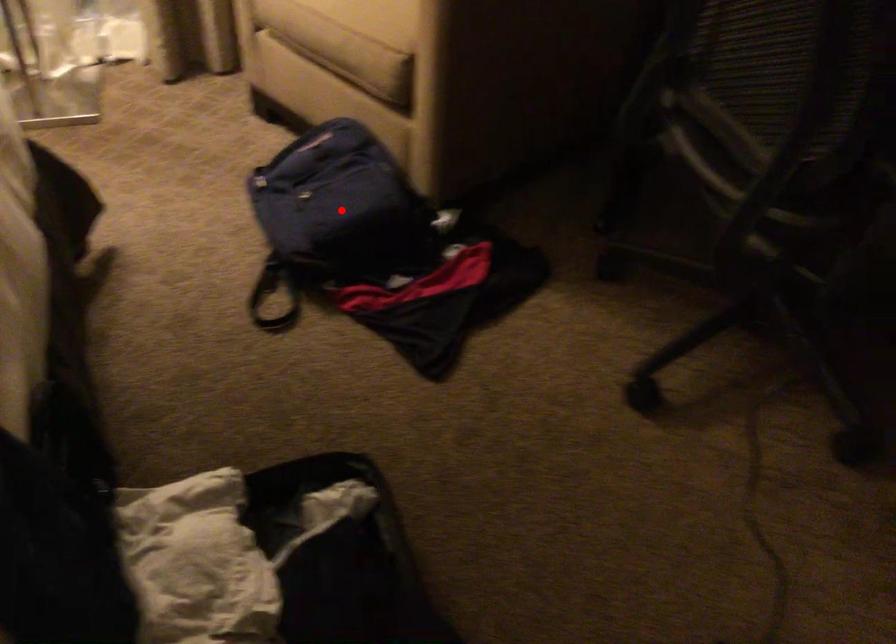
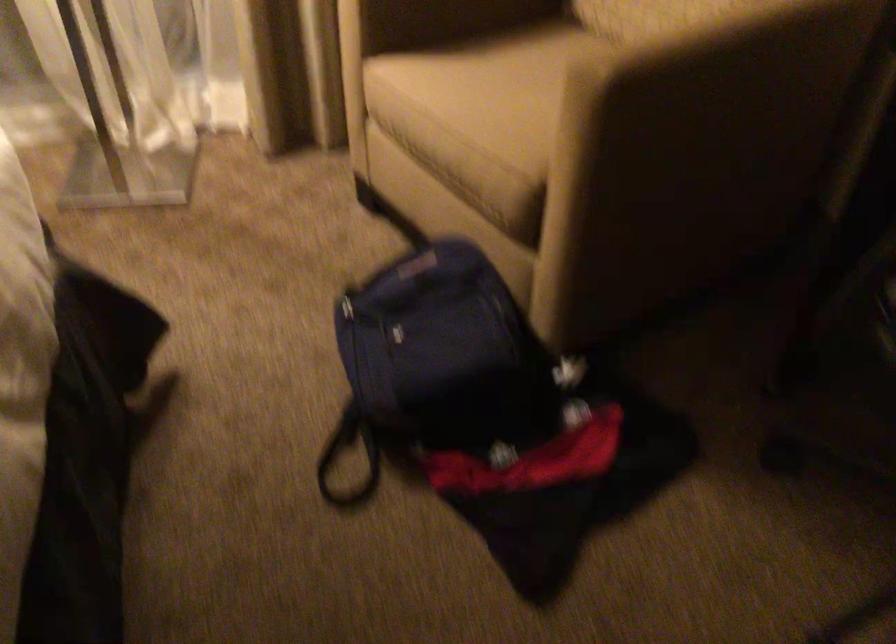
Where in the second image is the point corresponding to the highlighted location from the first image?

(442, 366)